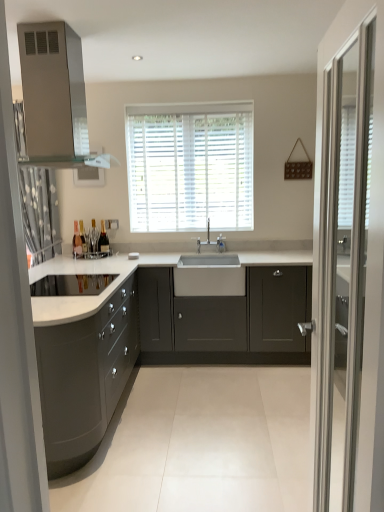
At what (x,y) coordinates should I click in order to perform the action: click on vacant location below white blinds at center (from a real-world perspective). Please return your answer as a coordinate pair (x, y). Looking at the image, I should click on (189, 228).